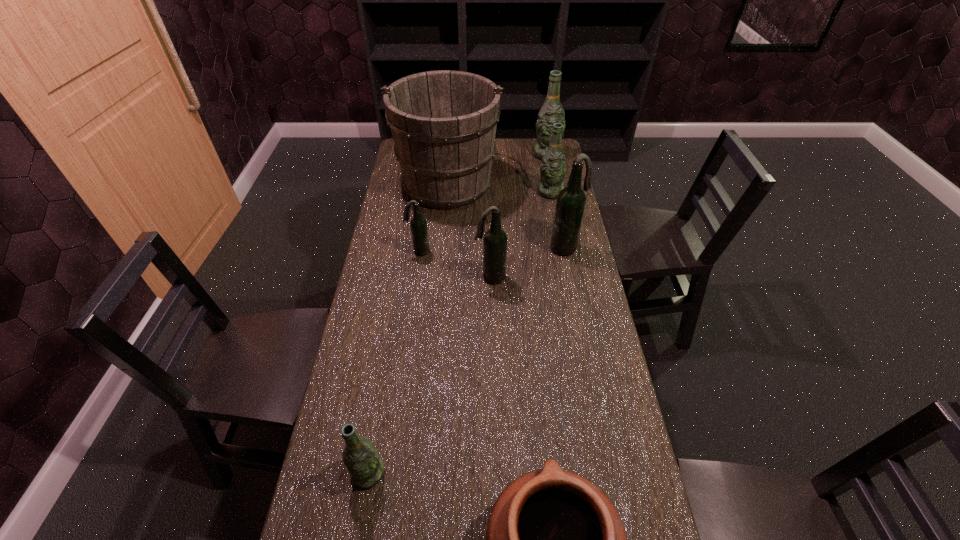
You are a GUI agent. You are given a task and a screenshot of the screen. Output one action in this format:
    pyautogui.click(x=<x>, y=<y>)
    Task: Click on the bucket located at the left edge
    
    Given the screenshot: What is the action you would take?
    pyautogui.click(x=443, y=123)

Image resolution: width=960 pixels, height=540 pixels. Find the location of `object that is at the far left corner`. object that is at the far left corner is located at coordinates (443, 123).

This screenshot has width=960, height=540. In order to click on object at the far right corner in this screenshot , I will do `click(552, 111)`.

This screenshot has width=960, height=540. I want to click on vacant space at the left edge of the desktop, so click(x=396, y=166).

Where is `free space at the right edge of the desktop`? Image resolution: width=960 pixels, height=540 pixels. free space at the right edge of the desktop is located at coordinates (583, 410).

The height and width of the screenshot is (540, 960). In the image, there is a desktop. Identify the location of vacant space at the far right corner. (531, 154).

The height and width of the screenshot is (540, 960). I want to click on vacant space that's between the biggest dark beer bottle and the smallest green beer bottle, so click(x=468, y=360).

At what (x,y) coordinates should I click in order to perform the action: click on empty location between the farthest beer bottle and the leftmost dark beer bottle. Please return your answer as a coordinate pair (x, y). The image size is (960, 540). Looking at the image, I should click on (483, 203).

You are a GUI agent. You are given a task and a screenshot of the screen. Output one action in this format:
    pyautogui.click(x=<x>, y=<y>)
    Task: Click on the object that is the third closest to the leftmost dark beer bottle
    
    Given the screenshot: What is the action you would take?
    pyautogui.click(x=571, y=200)

Find the location of a particular element. object that is the closest to the leftmost dark beer bottle is located at coordinates (443, 123).